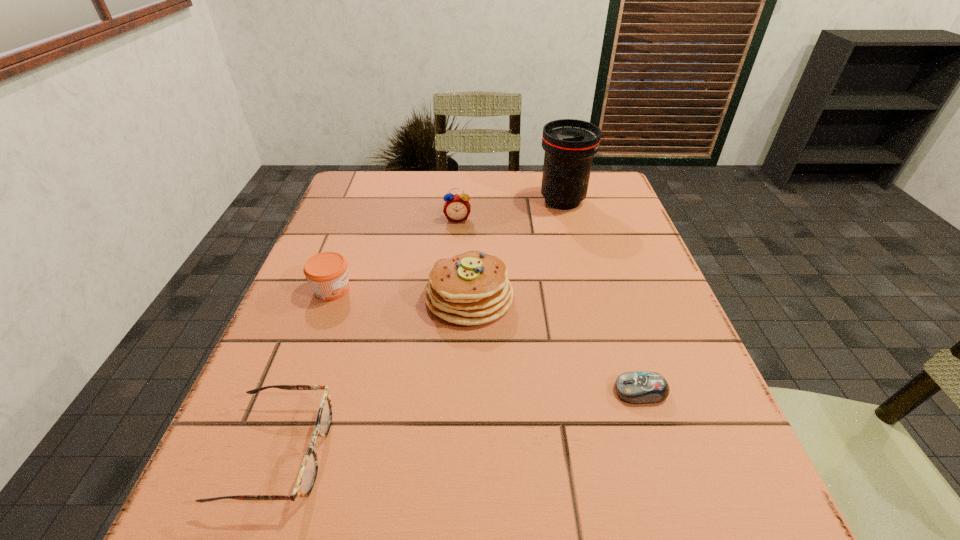
Where is `free point located on the frame of the second shortest object`? Image resolution: width=960 pixels, height=540 pixels. free point located on the frame of the second shortest object is located at coordinates tap(595, 453).

Identify the location of blank space located on the wheel side of the computer mouse. (428, 391).

Locate an element on the screen. The image size is (960, 540). vacant point located on the wheel side of the computer mouse is located at coordinates (579, 391).

I want to click on blank area located on the wheel side of the computer mouse, so click(440, 391).

The width and height of the screenshot is (960, 540). I want to click on telephoto lens present at the far edge, so click(x=569, y=144).

Identify the location of alarm clock situated at the far edge. The height and width of the screenshot is (540, 960). (457, 208).

Find the location of a particular element. The height and width of the screenshot is (540, 960). object that is at the near edge is located at coordinates (308, 472).

Find the location of a particular element. jam at the left edge is located at coordinates (327, 272).

I want to click on spectacles present at the left edge, so click(308, 472).

Identify the location of telephoto lens that is positioned at the right edge. The height and width of the screenshot is (540, 960). (569, 144).